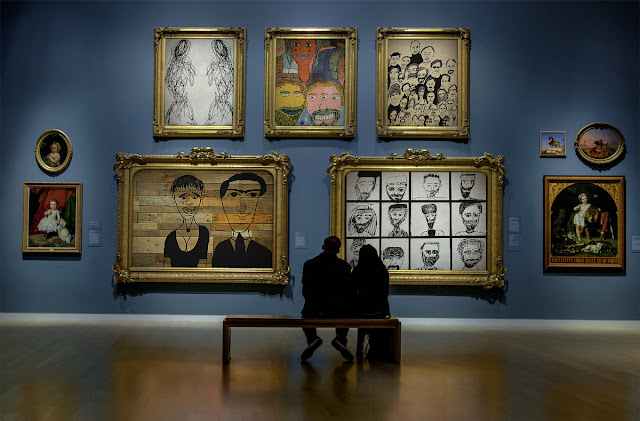
This screenshot has width=640, height=421. In order to click on wood planks in this screenshot , I will do `click(136, 224)`.